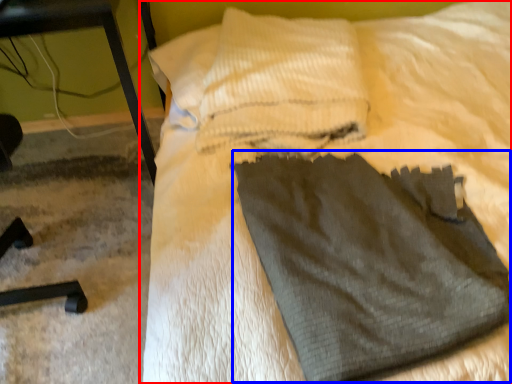
Question: Among these objects, which one is nearest to the camera, bed (highlighted by a red box) or sweat pant (highlighted by a blue box)?

Choices:
 (A) bed
 (B) sweat pant

Answer: (A)